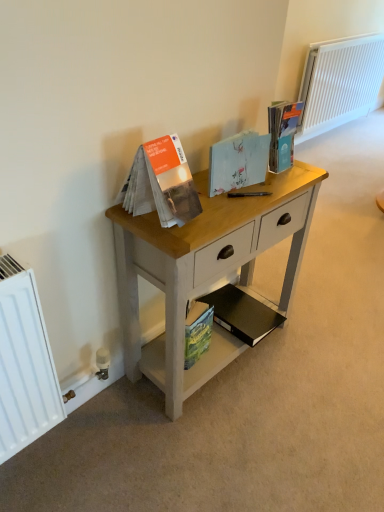
Where is `free space in front of white painted radiator at upper right`? The width and height of the screenshot is (384, 512). free space in front of white painted radiator at upper right is located at coordinates (352, 158).